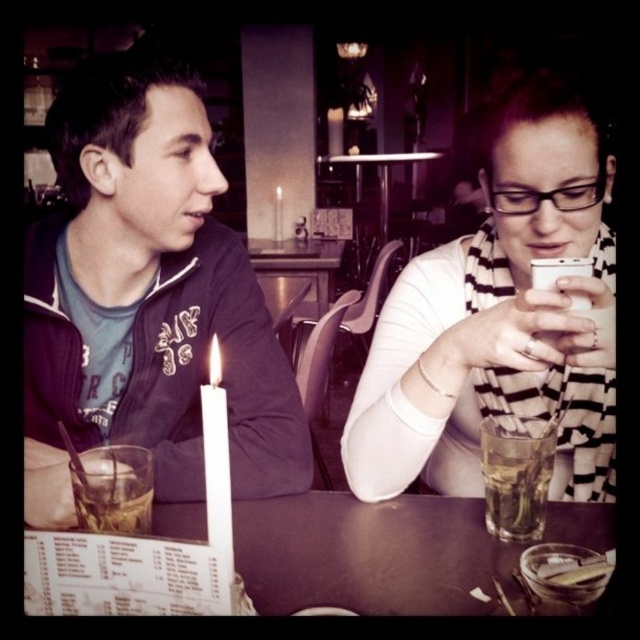
You are standing at the point marked as point (580, 394) in the image. You want to reach the door located at the opposite side of the room without moving closer than 80 centimeters to any person in the scene. Is this possible?

The distance between you and the viewer is 89.07 centimeters, which is greater than the 80 centimeter minimum required. Therefore, you can safely move to the door without violating the distance constraint.

You are standing at the entrance of the cafe and want to find the matte black jacket at center. According to the coordinates provided, where should you look to locate it?

The matte black jacket at center is located at point coordinates 0.497 along the x axis and 0.781 along the y axis.

You are a photographer trying to capture a clear shot of the white striped scarf at center without the matte black jacket at left blocking it. Can you adjust your position to do so?

The matte black jacket at left is positioned over the white striped scarf at center, so moving your camera angle slightly downward or to the side might allow you to capture the scarf without obstruction.